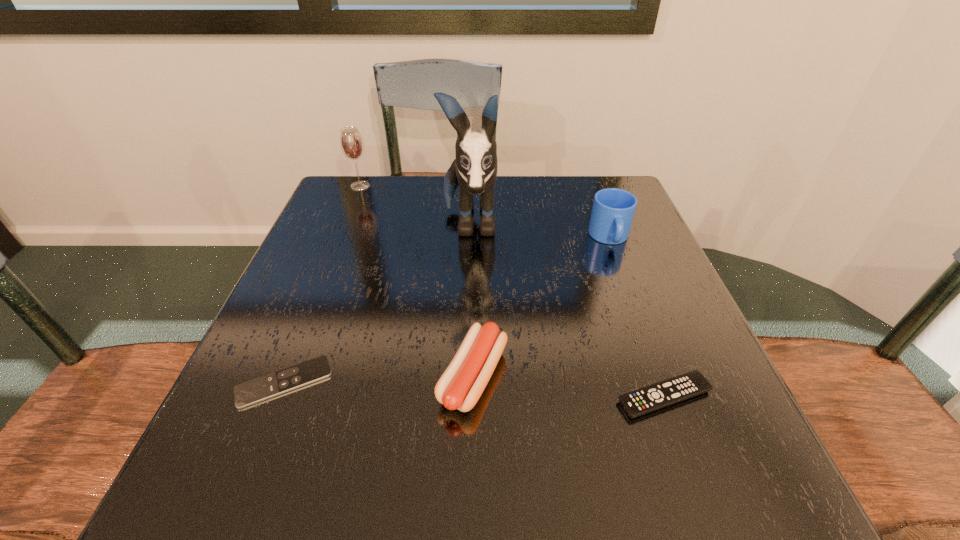
Where is `mug at the right edge`? The width and height of the screenshot is (960, 540). mug at the right edge is located at coordinates (613, 209).

What are the coordinates of `remote control situated at the right edge` in the screenshot? It's located at (659, 395).

Find the location of `object that is positioned at the far left corner`. object that is positioned at the far left corner is located at coordinates (352, 146).

Image resolution: width=960 pixels, height=540 pixels. I want to click on object at the far right corner, so click(613, 209).

Locate an element on the screen. vacant space at the far edge of the desktop is located at coordinates (532, 188).

Locate an element on the screen. Image resolution: width=960 pixels, height=540 pixels. free space at the near edge of the desktop is located at coordinates (465, 457).

Locate an element on the screen. free space at the left edge of the desktop is located at coordinates (350, 293).

In the image, there is a desktop. Identify the location of vacant space at the right edge. (643, 319).

This screenshot has height=540, width=960. In the image, there is a desktop. Identify the location of vacant space at the far left corner. (345, 220).

This screenshot has width=960, height=540. I want to click on vacant region at the near left corner of the desktop, so click(x=229, y=474).